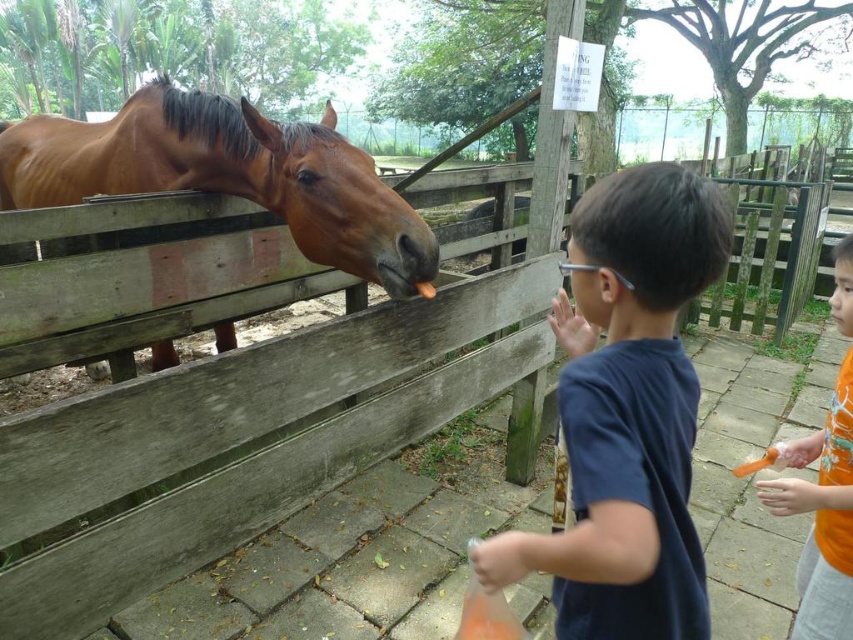
You are a tour guide leading a group of children at the zoo. You need to ensure that the safety distance between the visitors and the animals is maintained. The safety guideline states that visitors must stay at least 2 meters away from the animals. Based on the image, is the distance between the brown glossy horse at left and the orange fabric shirt at right meeting the safety requirement?

The brown glossy horse at left and the orange fabric shirt at right are 2.27 meters apart from each other, which exceeds the required 2 meters safety distance. Therefore, the current distance meets the safety requirement.

You are standing at the entrance of the petting zoo and want to reach the point marked at coordinates [612,499]. If your average walking speed is 3 miles per hour, how many seconds will it take you to reach that point?

The distance to the point is 39.24 inches. Converting that to feet, it is 3.27 feet. Since 1 mile is 5280 feet, 3 miles per hour equals 4.4 feet per second. Time taken would be distance divided by speed, so 3.27 divided by 4.4 equals approximately 0.74 seconds. However, this calculation assumes a direct path and no obstacles, which might not be realistic in a petting zoo setting.